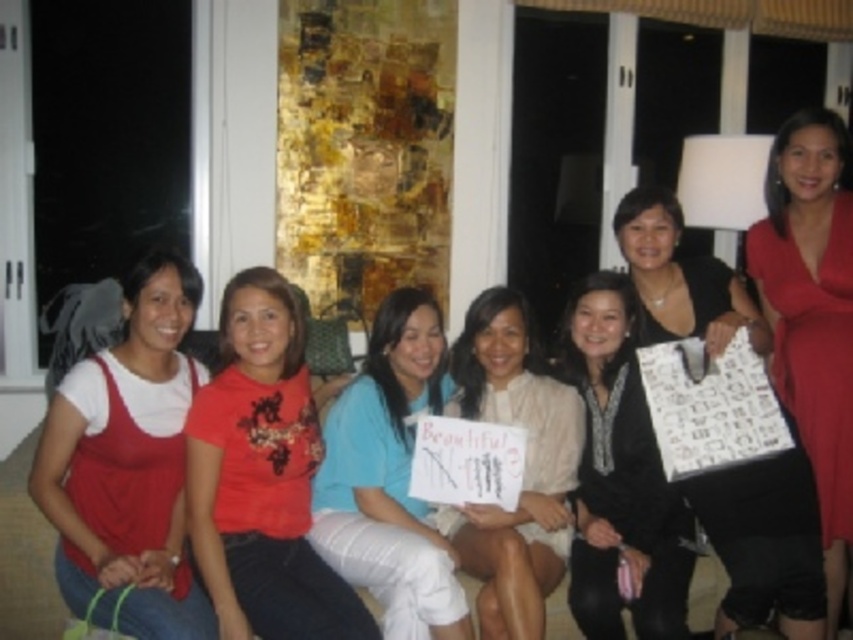
Based on the photo, between black matte bag at center and black satin dress at center, which one appears on the right side from the viewer's perspective?

Positioned to the right is black matte bag at center.

At what (x,y) coordinates should I click in order to perform the action: click on black matte bag at center. Please return your answer as a coordinate pair (x, y). The height and width of the screenshot is (640, 853). Looking at the image, I should click on (764, 541).

Locate an element on the screen. black matte bag at center is located at coordinates (764, 541).

Between black matte bag at center and matte blue shirt at center, which one appears on the right side from the viewer's perspective?

black matte bag at center is more to the right.

Is black matte bag at center taller than matte blue shirt at center?

Correct, black matte bag at center is much taller as matte blue shirt at center.

The height and width of the screenshot is (640, 853). What do you see at coordinates (764, 541) in the screenshot? I see `black matte bag at center` at bounding box center [764, 541].

Identify the location of black matte bag at center. (764, 541).

Does black matte bag at center appear on the left side of white matte sign at center?

No, black matte bag at center is not to the left of white matte sign at center.

Does black matte bag at center have a greater width compared to white matte sign at center?

Yes, black matte bag at center is wider than white matte sign at center.

Which is behind, point (712, 323) or point (525, 352)?

The point (525, 352) is more distant.

This screenshot has width=853, height=640. I want to click on black matte bag at center, so click(764, 541).